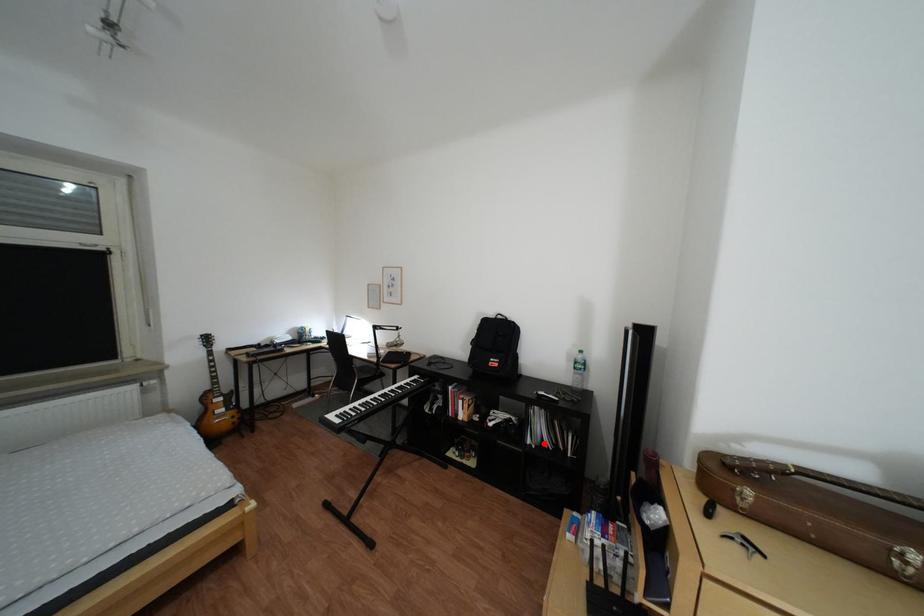
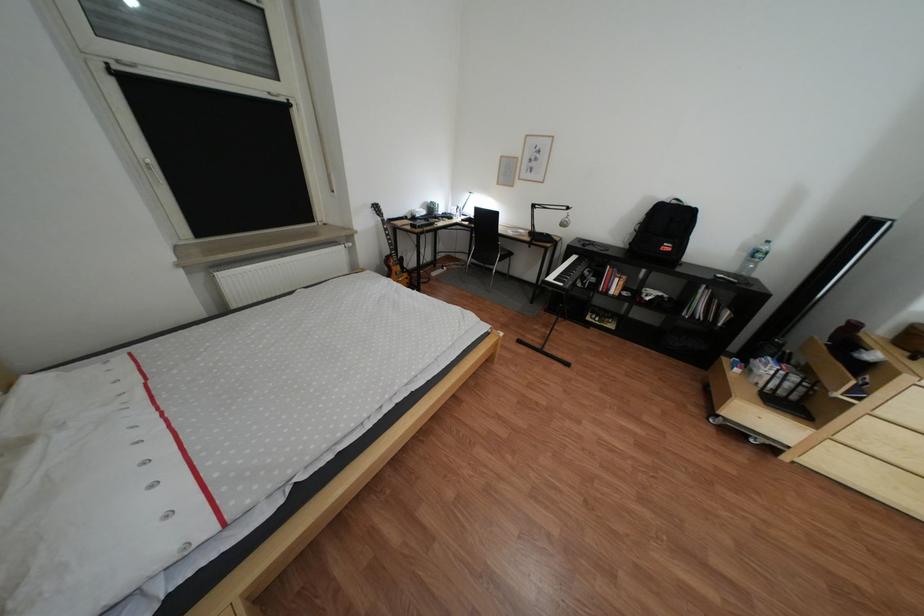
Question: I am providing you with two images of the same scene from different viewpoints. In image1, a red point is highlighted. Considering the same 3D point in image2, which of the following is correct?

Choices:
 (A) It is closer
 (B) It is farther

Answer: (A)